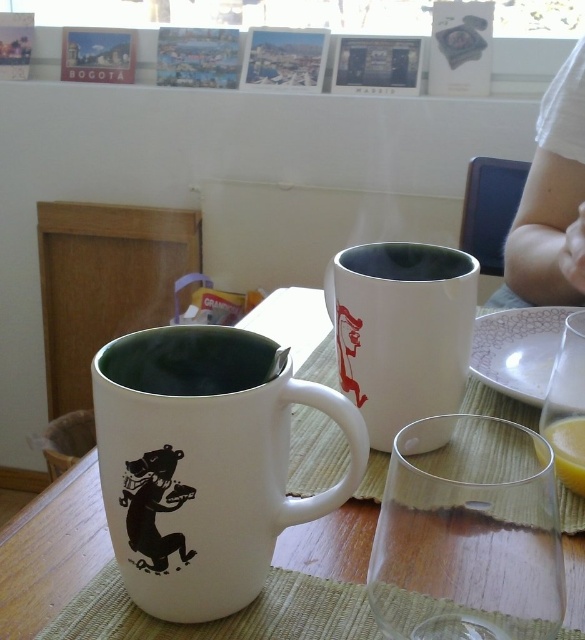
Question: Is white ceramic mug at center wider than white ceramic mug at upper center?

Choices:
 (A) no
 (B) yes

Answer: (B)

Question: Which point is closer to the camera?

Choices:
 (A) (500, 376)
 (B) (215, 362)
 (C) (436, 348)

Answer: (B)

Question: Can you confirm if white matte mug at left is bigger than porcelain plate at upper right?

Choices:
 (A) no
 (B) yes

Answer: (B)

Question: In this image, where is white ceramic mug at upper center located relative to white matte cup at center?

Choices:
 (A) right
 (B) left

Answer: (B)

Question: Which of these objects is positioned farthest from the white matte mug at left?

Choices:
 (A) transparent glass at center
 (B) white ceramic mug at center
 (C) white ceramic mug at upper center

Answer: (C)

Question: Which point is farther to the camera?

Choices:
 (A) (192, 381)
 (B) (581, 566)
 (C) (469, 268)

Answer: (C)